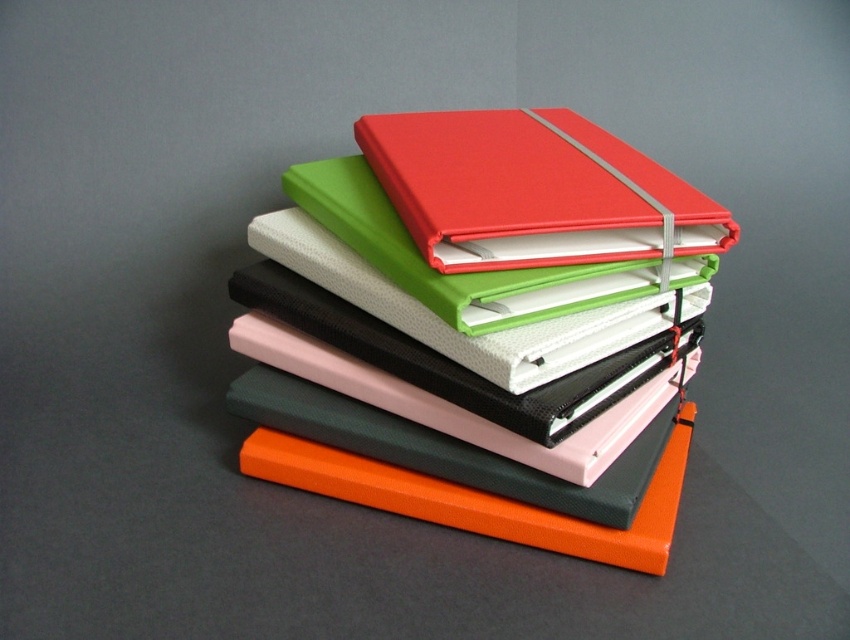
You are organizing a desk and need to place a new red binder to the left of an orange binder. Looking at the stack of notebooks, is the current position of the matte red binder at upper center and the orange matte binder at center aligned with your requirement?

The matte red binder at upper center is positioned on the right side of orange matte binder at center, so it is not aligned with your requirement to place the red binder to the left of the orange binder.

You are a delivery person who needs to place a new matte red binder at center onto a shelf that is 1.2 meters away from you. Can you reach the shelf from your current position without moving closer?

The matte red binder at center is currently 1.12 meters away from the camera, so yes, you can reach the shelf since it is only 1.2 meters away, which is slightly farther than the current distance.